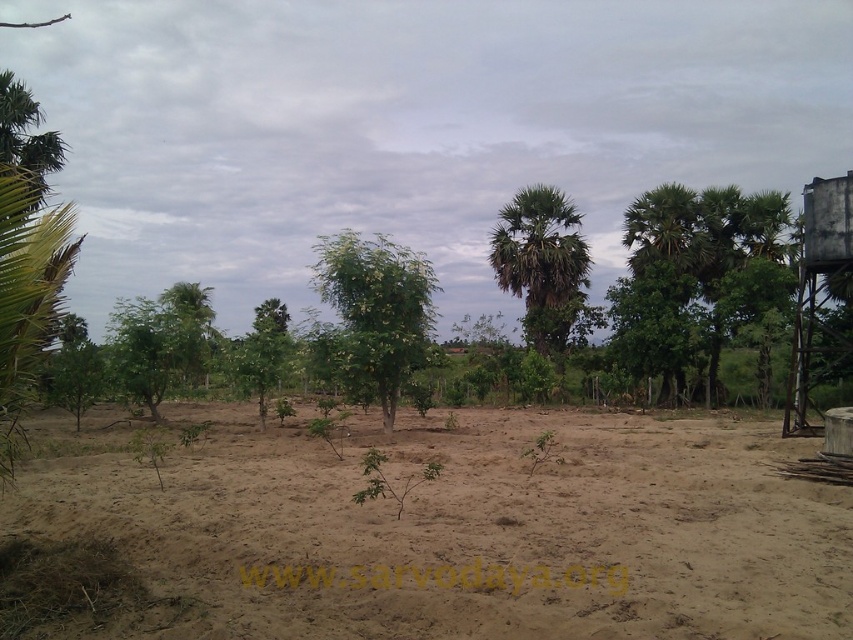
You are standing in the open sandy area looking at the scene. There are two points marked in the image, point (260,614) and point (561,262). Which point is closer to you?

Point (260,614) is closer to the viewer than point (561,262).

You are standing at the point marked by coordinates point (x=378, y=308) in the open sandy area. What type of tree are you directly under?

The point (x=378, y=308) indicates a green leafy tree at center, so you are directly under the green leafy tree at center.